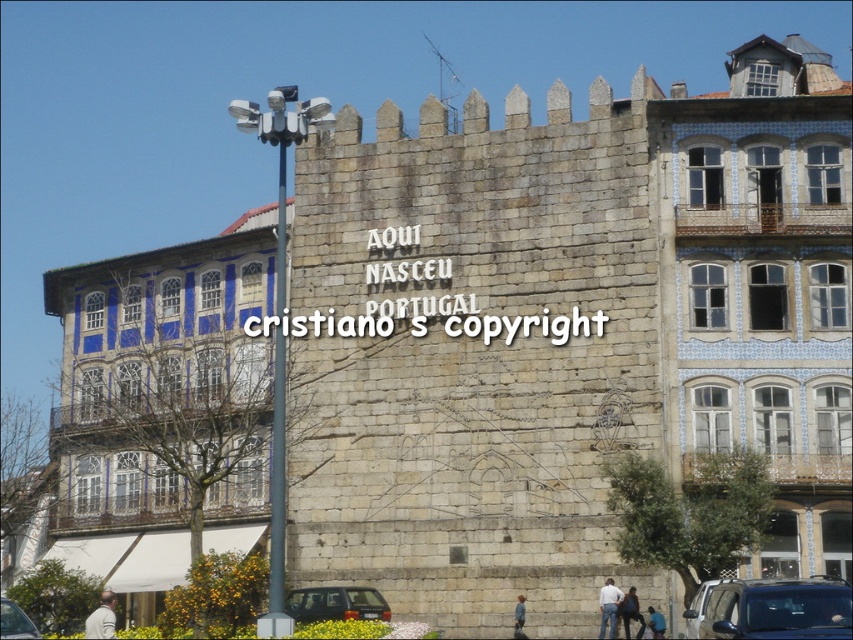
You are a photographer planning to capture a wide shot of the historical stone wall with the inscription. You have a metallic silver car at lower right and dark blue jeans at lower center in your frame. Which object will appear bigger in the final photo?

The metallic silver car at lower right will appear bigger in the final photo because it has a larger size compared to the dark blue jeans at lower center.

You are standing at the base of the historical stone wall and want to take a photo of the inscription. The camera you are using has a maximum focus range of 50 meters. Is the point where the inscription is located, point (x=770, y=589), within the camera focus range?

The distance of point (x=770, y=589) from the camera is 51.55 meters, which exceeds the camera maximum focus range of 50 meters. Therefore, the camera cannot focus on the inscription at point (x=770, y=589).